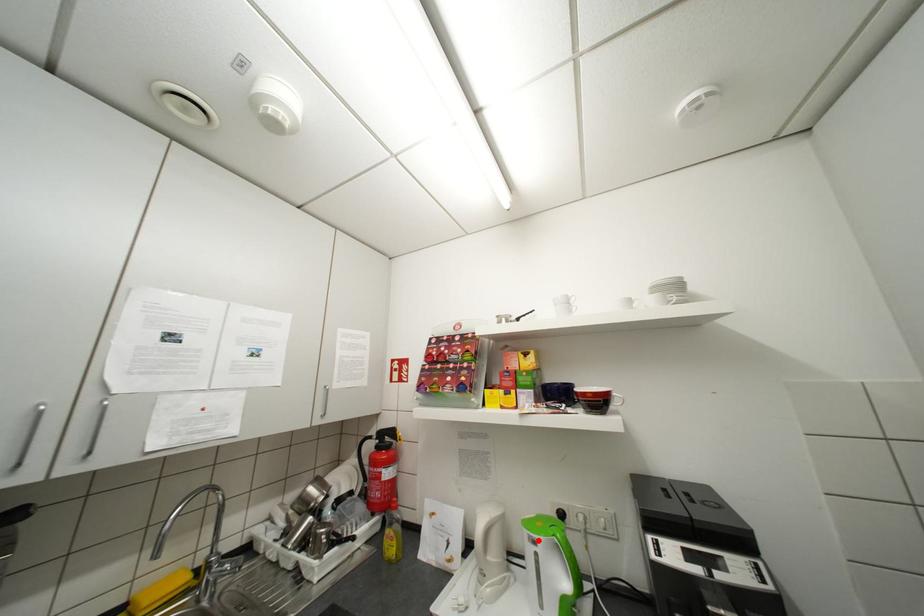
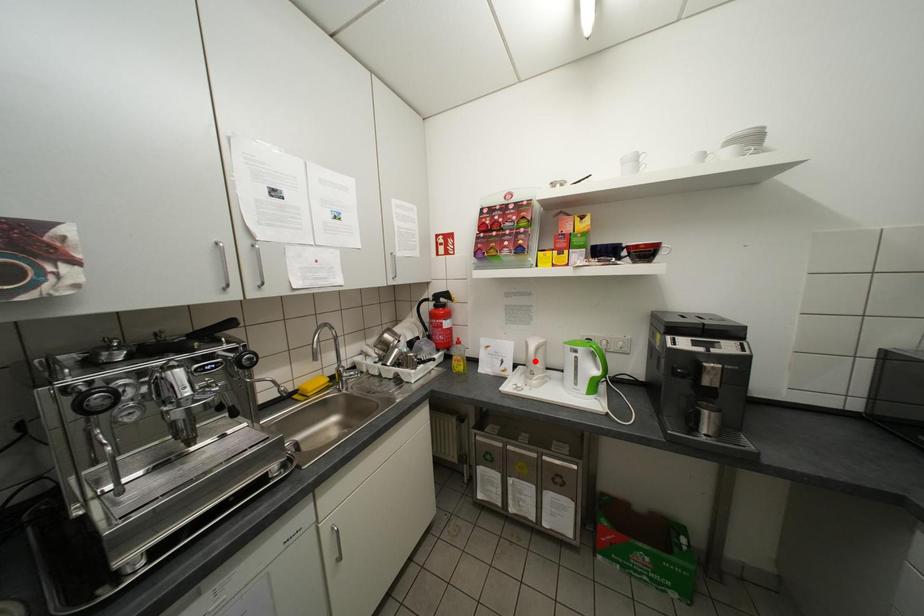
I am providing you with two images of the same scene from different viewpoints. A red point is marked on the first image and another point is marked on the second image. Are the points marked in image1 and image2 representing the same 3D position?

No